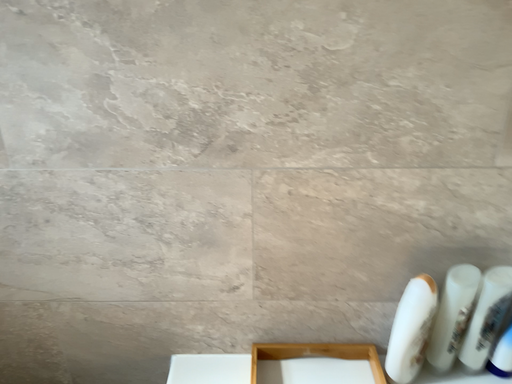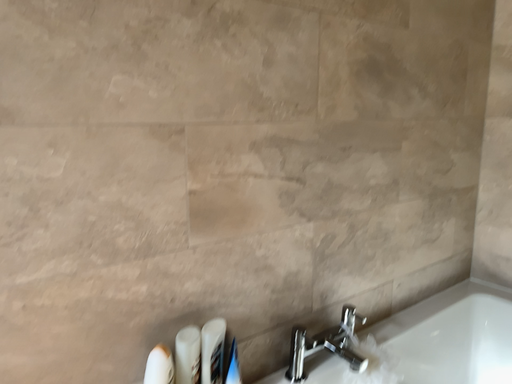
Question: Which way did the camera rotate in the video?

Choices:
 (A) rotated downward
 (B) rotated upward

Answer: (B)